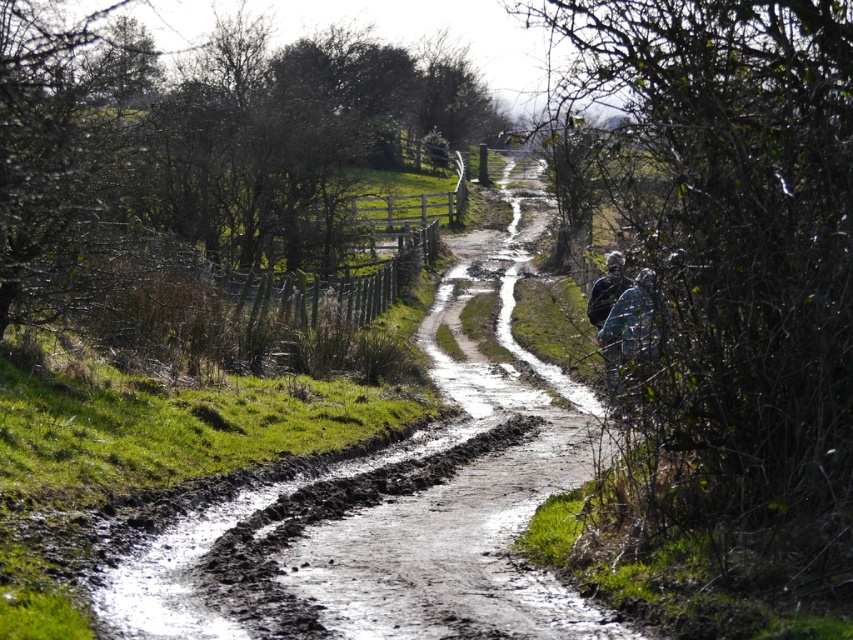
Question: Is blue fabric at right above camouflage fabric backpack at right?

Choices:
 (A) yes
 (B) no

Answer: (A)

Question: Does blue fabric at right have a greater width compared to camouflage fabric backpack at right?

Choices:
 (A) no
 (B) yes

Answer: (A)

Question: Can you confirm if blue fabric at right is thinner than camouflage fabric backpack at right?

Choices:
 (A) yes
 (B) no

Answer: (A)

Question: Which point appears closest to the camera in this image?

Choices:
 (A) (596, 292)
 (B) (641, 276)

Answer: (B)

Question: Among these objects, which one is nearest to the camera?

Choices:
 (A) blue fabric at right
 (B) camouflage fabric backpack at right

Answer: (A)